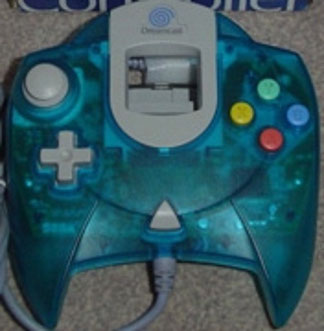
Where is `carpet`? The image size is (324, 331). carpet is located at coordinates (295, 36).